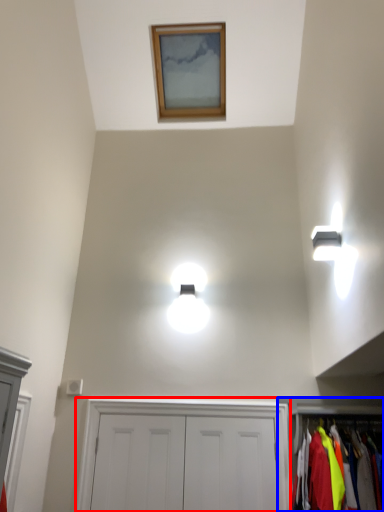
Question: Which of the following is the farthest to the observer, dresser (highlighted by a red box) or dresser (highlighted by a blue box)?

Choices:
 (A) dresser
 (B) dresser

Answer: (A)